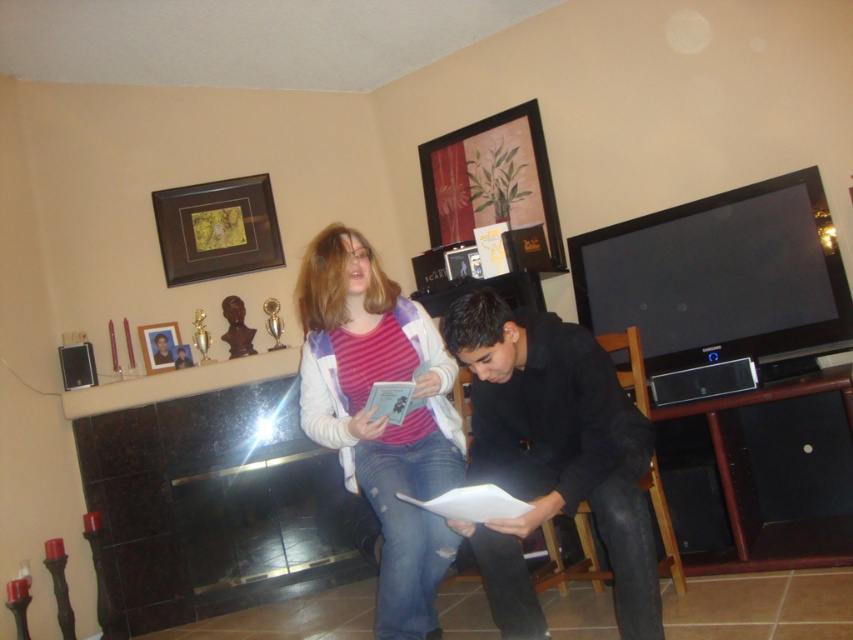
Question: Does matte wooden picture frame at upper center appear under brown wooden picture frame at upper left?

Choices:
 (A) yes
 (B) no

Answer: (B)

Question: Which is farther from the brown wooden picture frame at upper left?

Choices:
 (A) striped knit sweater at center
 (B) wooden photo frame at upper left

Answer: (A)

Question: Which point is farther from the camera taking this photo?

Choices:
 (A) (506, 122)
 (B) (173, 333)
 (C) (595, 432)
 (D) (235, 224)

Answer: (D)

Question: Is matte wooden picture frame at upper center further to the viewer compared to brown wooden picture frame at upper left?

Choices:
 (A) no
 (B) yes

Answer: (A)

Question: Is black matte shirt at center thinner than brown wooden picture frame at upper left?

Choices:
 (A) no
 (B) yes

Answer: (A)

Question: Which point is farther from the camera taking this photo?

Choices:
 (A) tap(641, 515)
 (B) tap(149, 372)

Answer: (B)